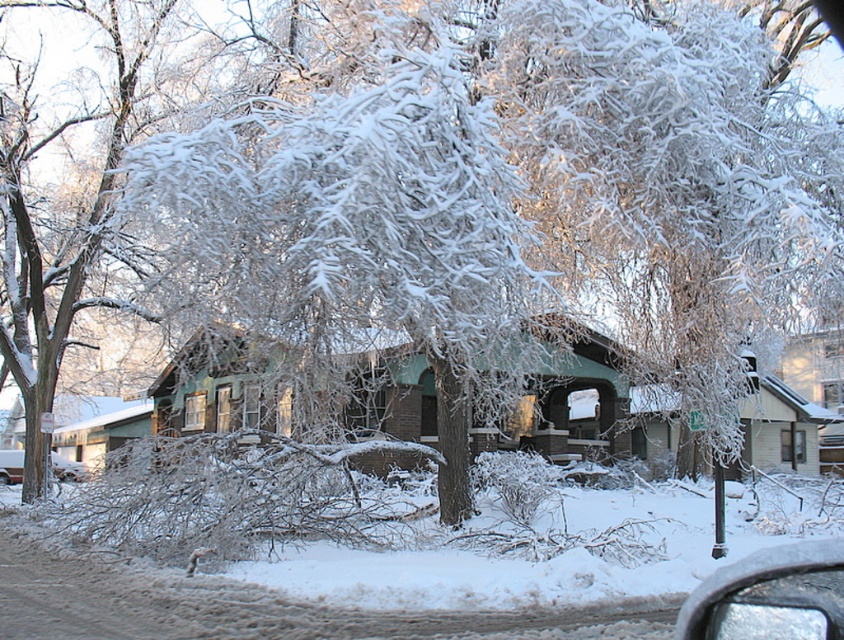
You are sitting in a car with a clear glass mirror at lower right. You notice a point at coordinates [771,595]. What object is located at that point?

The clear glass mirror at lower right is located at point [771,595].